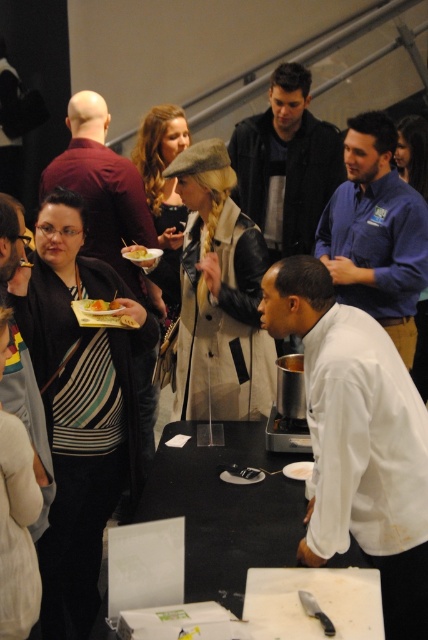
You are attending this event and want to place your black leather jacket at upper center on the black matte table at center. Is the table to the left or right of your jacket?

The black matte table at center is positioned on the left side of the black leather jacket at upper center, so the table is to the left of your jacket.

You are a guest at the event and want to place your black leather jacket at upper center on the black matte table at center. Based on the size of the table, will the jacket fit without hanging over the edges?

The black matte table at center has a smaller size compared to black leather jacket at upper center, so the jacket will not fit on the table without hanging over the edges.

You are attending a cooking demonstration and need to place a 10 cm wide ingredient container on the black matte table at center. Can you determine if there is enough space based on its position?

The black matte table at center is located at point [225,509], but without knowing the table dimensions or the required space for the container, it is impossible to determine if there is enough space. Please provide more information about the table size or the container requirements.